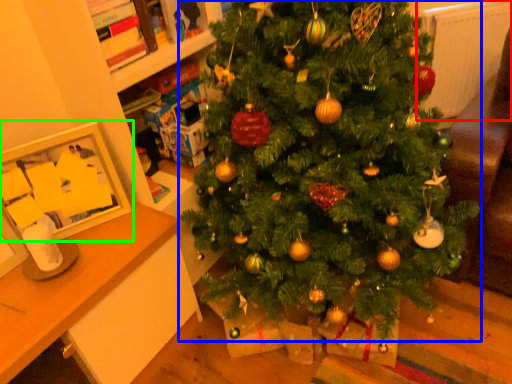
Question: Which object is positioned closest to radiator (highlighted by a red box)? Select from christmas tree (highlighted by a blue box) and picture frame (highlighted by a green box).

Choices:
 (A) christmas tree
 (B) picture frame

Answer: (A)